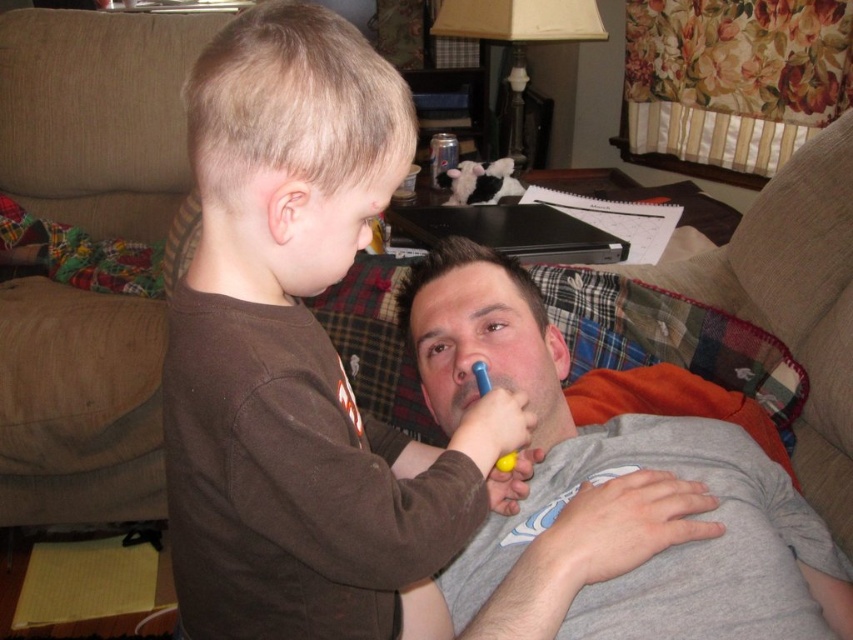
How distant is brown cotton shirt at upper left from gray cotton shirt at center?

brown cotton shirt at upper left is 24.88 centimeters away from gray cotton shirt at center.

I want to click on brown cotton shirt at upper left, so click(x=303, y=356).

Is brown cotton shirt at upper left taller than blue plastic toothbrush at center?

Indeed, brown cotton shirt at upper left has a greater height compared to blue plastic toothbrush at center.

Between point (252, 209) and point (505, 460), which one is positioned behind?

Point (505, 460)

Find the location of a particular element. brown cotton shirt at upper left is located at coordinates (303, 356).

Who is more distant from viewer, (x=96, y=44) or (x=798, y=595)?

The point (x=96, y=44) is behind.

Is beige fabric couch at upper left below gray cotton shirt at center?

No.

Between point (44, 81) and point (846, 630), which one is positioned behind?

Point (44, 81)

Where is `beige fabric couch at upper left`? This screenshot has width=853, height=640. beige fabric couch at upper left is located at coordinates (97, 115).